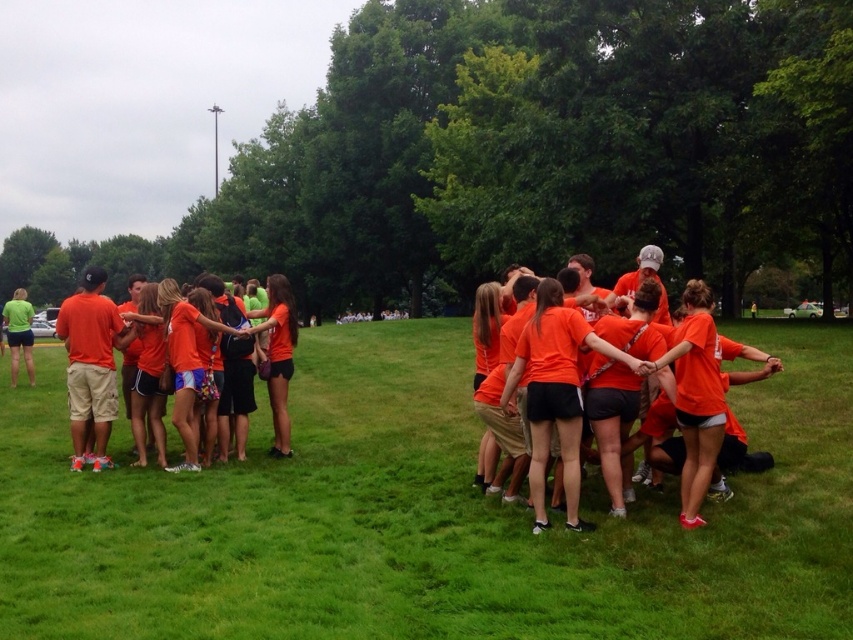
Question: Which of the following is the farthest from the observer?

Choices:
 (A) green grass at center
 (B) orange matte shirt at center

Answer: (B)

Question: From the image, what is the correct spatial relationship of orange matte shirt at center in relation to orange cotton shirt at center?

Choices:
 (A) right
 (B) left

Answer: (A)

Question: Which object appears farthest from the camera in this image?

Choices:
 (A) orange fabric shirt at center
 (B) orange matte shirt at center

Answer: (A)

Question: Can you confirm if orange matte shirt at center is wider than matte green shirt at left?

Choices:
 (A) no
 (B) yes

Answer: (A)

Question: Which point is farther to the camera?

Choices:
 (A) (164, 292)
 (B) (482, 310)
 (C) (190, 582)

Answer: (A)

Question: Is orange fabric shirt at center closer to camera compared to matte green shirt at left?

Choices:
 (A) yes
 (B) no

Answer: (A)